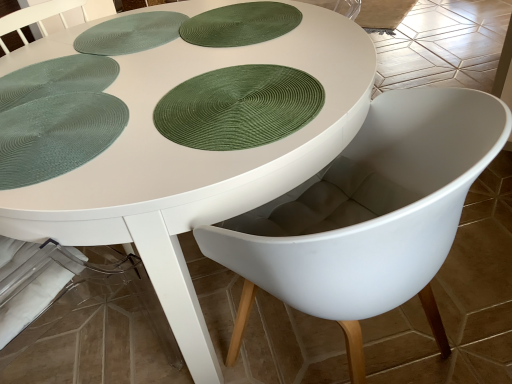
What are the coordinates of `empty space that is in between green woven placemat at center, which is counted as the third paper plate, starting from the top, and green textured placemat at left, marked as the first paper plate in a bottom-to-top arrangement` in the screenshot? It's located at (138, 109).